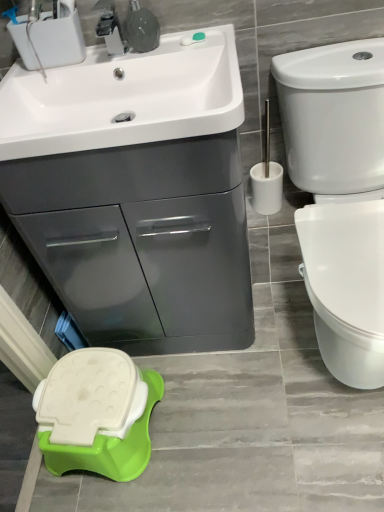
This screenshot has width=384, height=512. Find the location of `vacant area that is in front of matte gray cabinet at upper left`. vacant area that is in front of matte gray cabinet at upper left is located at coordinates (211, 421).